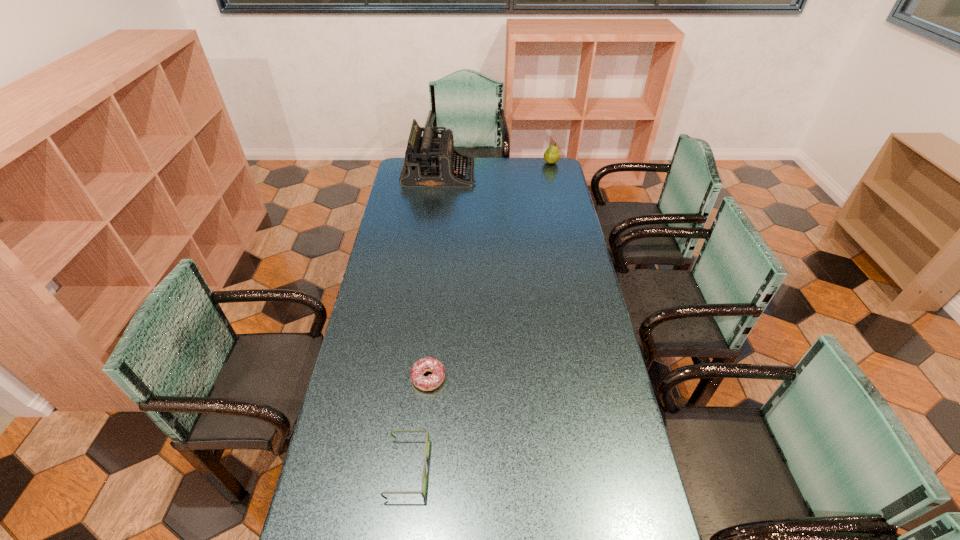
Locate an element on the screen. The width and height of the screenshot is (960, 540). free space between the nearest object and the tallest object is located at coordinates (423, 321).

The width and height of the screenshot is (960, 540). In order to click on vacant space in between the third farthest object and the typewriter in this screenshot , I will do coord(434,276).

Where is `unoccupied area between the shortest object and the pear`? This screenshot has height=540, width=960. unoccupied area between the shortest object and the pear is located at coordinates (490, 271).

Find the location of a particular element. This screenshot has width=960, height=540. empty space between the rightmost object and the tallest object is located at coordinates (495, 168).

Where is `free space that is in between the spectacles and the shortest object`? This screenshot has width=960, height=540. free space that is in between the spectacles and the shortest object is located at coordinates (418, 423).

The width and height of the screenshot is (960, 540). In order to click on vacant space that's between the spectacles and the tallest object in this screenshot , I will do `click(423, 321)`.

Find the location of `vacant point located between the nearest object and the tallest object`. vacant point located between the nearest object and the tallest object is located at coordinates (423, 321).

The width and height of the screenshot is (960, 540). Find the location of `blank region between the shortest object and the nearest object`. blank region between the shortest object and the nearest object is located at coordinates (418, 423).

The image size is (960, 540). In order to click on object that stands as the closest to the spectacles in this screenshot , I will do `click(429, 364)`.

Locate which object ranks second in proximity to the second nearest object. Please provide its 2D coordinates. Your answer should be formatted as a tuple, i.e. [(x, y)], where the tuple contains the x and y coordinates of a point satisfying the conditions above.

[(430, 162)]